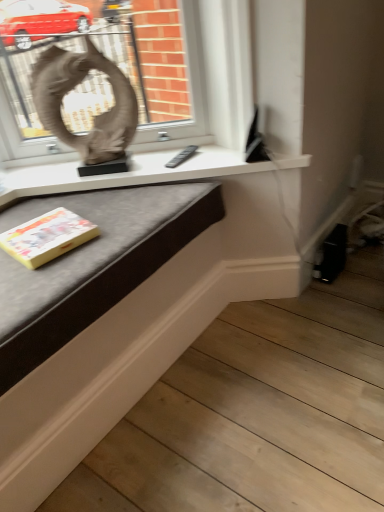
Where is `yellow paper at lower left`? yellow paper at lower left is located at coordinates (47, 237).

What is the approximate height of matte white table at center?

→ matte white table at center is 2.17 inches tall.

Where is `yellow paper at lower left`? The width and height of the screenshot is (384, 512). yellow paper at lower left is located at coordinates (47, 237).

From a real-world perspective, is matte gray sculpture at upper left under yellow paper at lower left?

No, from a real-world perspective, matte gray sculpture at upper left is not below yellow paper at lower left.

How many degrees apart are the facing directions of matte gray sculpture at upper left and yellow paper at lower left?

matte gray sculpture at upper left and yellow paper at lower left are facing 42.1 degrees away from each other.

Does point (57, 132) lie in front of point (41, 262)?

No, it is behind (41, 262).

Which of these two, matte gray sculpture at upper left or yellow paper at lower left, stands taller?

matte gray sculpture at upper left.

Is yellow paper at lower left far from matte white table at center?

yellow paper at lower left is actually quite close to matte white table at center.

Considering the sizes of objects yellow paper at lower left and matte white table at center in the image provided, who is smaller, yellow paper at lower left or matte white table at center?

With smaller size is yellow paper at lower left.

From a real-world perspective, is yellow paper at lower left below matte white table at center?

Yes, from a real-world perspective, yellow paper at lower left is beneath matte white table at center.

In the image, there is a matte white table at center. Where is `paperback book below it (from the image's perspective)`? Image resolution: width=384 pixels, height=512 pixels. paperback book below it (from the image's perspective) is located at coordinates (47, 237).

Between matte white table at center and matte gray sculpture at upper left, which one appears on the left side from the viewer's perspective?

From the viewer's perspective, matte gray sculpture at upper left appears more on the left side.

From the image's perspective, which is above, matte white table at center or matte gray sculpture at upper left?

matte gray sculpture at upper left.

In the scene shown: Between matte white table at center and matte gray sculpture at upper left, which one has larger width?

matte white table at center is wider.

Could you tell me if matte white table at center is turned towards matte gray sculpture at upper left?

No, matte white table at center is not turned towards matte gray sculpture at upper left.

Where is `paperback book behind the matte white table at center`? paperback book behind the matte white table at center is located at coordinates (47, 237).

Does matte white table at center turn towards yellow paper at lower left?

No, matte white table at center is not turned towards yellow paper at lower left.

Which of these two, matte white table at center or yellow paper at lower left, is bigger?

Bigger between the two is matte white table at center.

Is matte white table at center far from yellow paper at lower left?

matte white table at center is near yellow paper at lower left, not far away.

Is yellow paper at lower left oriented away from matte gray sculpture at upper left?

No, matte gray sculpture at upper left is not at the back of yellow paper at lower left.

Which of these two, yellow paper at lower left or matte gray sculpture at upper left, stands taller?

Standing taller between the two is matte gray sculpture at upper left.

From the image's perspective, which object appears higher, yellow paper at lower left or matte gray sculpture at upper left?

matte gray sculpture at upper left, from the image's perspective.

Which is closer, [75,135] or [97,291]?

Clearly, point [75,135] is more distant from the camera than point [97,291].

Is matte gray sculpture at upper left taller or shorter than matte white table at center?

Considering their sizes, matte gray sculpture at upper left has more height than matte white table at center.

Is matte gray sculpture at upper left oriented away from matte white table at center?

matte gray sculpture at upper left is not turned away from matte white table at center.

From the picture: Measure the distance from matte gray sculpture at upper left to matte white table at center.

matte gray sculpture at upper left is 14.98 inches from matte white table at center.

Locate an element on the screen. paperback book on the left of the matte gray sculpture at upper left is located at coordinates (47, 237).

The height and width of the screenshot is (512, 384). I want to click on table on the right of yellow paper at lower left, so click(x=93, y=264).

From the image, which object appears to be nearer to yellow paper at lower left, matte gray sculpture at upper left or matte white table at center?

matte white table at center.

Estimate the real-world distances between objects in this image. Which object is closer to matte gray sculpture at upper left, yellow paper at lower left or matte white table at center?

matte white table at center lies closer to matte gray sculpture at upper left than the other object.

Looking at the image, which one is located further to matte white table at center, matte gray sculpture at upper left or yellow paper at lower left?

matte gray sculpture at upper left lies further to matte white table at center than the other object.

Based on their spatial positions, is yellow paper at lower left or matte gray sculpture at upper left further from matte white table at center?

matte gray sculpture at upper left.

Looking at the image, which one is located closer to matte gray sculpture at upper left, matte white table at center or yellow paper at lower left?

matte white table at center.

From the image, which object appears to be farther from yellow paper at lower left, matte white table at center or matte gray sculpture at upper left?

matte gray sculpture at upper left lies further to yellow paper at lower left than the other object.

The height and width of the screenshot is (512, 384). I want to click on paperback book positioned between matte white table at center and matte gray sculpture at upper left from near to far, so click(47, 237).